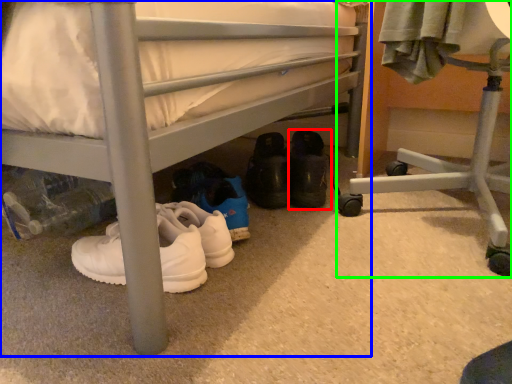
Question: Which object is the farthest from footwear (highlighted by a red box)? Choose among these: bed (highlighted by a blue box) or furniture (highlighted by a green box).

Choices:
 (A) bed
 (B) furniture

Answer: (A)